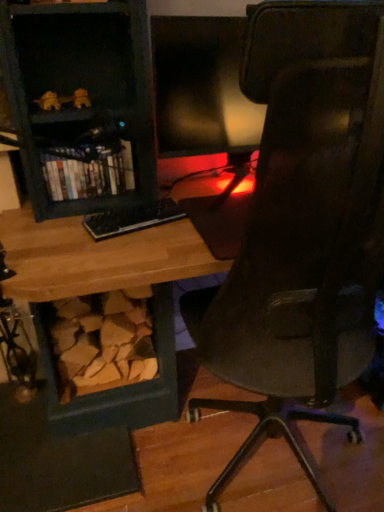
Question: From a real-world perspective, does black plastic keyboard at center sit lower than matte black monitor at center?

Choices:
 (A) yes
 (B) no

Answer: (A)

Question: Is black plastic keyboard at center wider than matte black monitor at center?

Choices:
 (A) yes
 (B) no

Answer: (B)

Question: Is black plastic keyboard at center surrounding matte black monitor at center?

Choices:
 (A) no
 (B) yes

Answer: (A)

Question: Is black plastic keyboard at center directly adjacent to matte black monitor at center?

Choices:
 (A) yes
 (B) no

Answer: (B)

Question: Is the position of black plastic keyboard at center more distant than that of matte black monitor at center?

Choices:
 (A) yes
 (B) no

Answer: (A)

Question: Would you say black plastic keyboard at center is a long distance from matte black monitor at center?

Choices:
 (A) no
 (B) yes

Answer: (A)

Question: Can you confirm if matte black bookshelf at left is taller than matte black monitor at center?

Choices:
 (A) yes
 (B) no

Answer: (B)

Question: Is matte black bookshelf at left bigger than matte black monitor at center?

Choices:
 (A) yes
 (B) no

Answer: (B)

Question: Is matte black bookshelf at left facing away from matte black monitor at center?

Choices:
 (A) no
 (B) yes

Answer: (A)

Question: Is matte black bookshelf at left positioned far away from matte black monitor at center?

Choices:
 (A) no
 (B) yes

Answer: (A)

Question: Is matte black bookshelf at left thinner than matte black monitor at center?

Choices:
 (A) yes
 (B) no

Answer: (B)

Question: Does matte black bookshelf at left turn towards matte black monitor at center?

Choices:
 (A) no
 (B) yes

Answer: (A)

Question: Is matte black monitor at center turned away from matte black bookshelf at left?

Choices:
 (A) no
 (B) yes

Answer: (A)